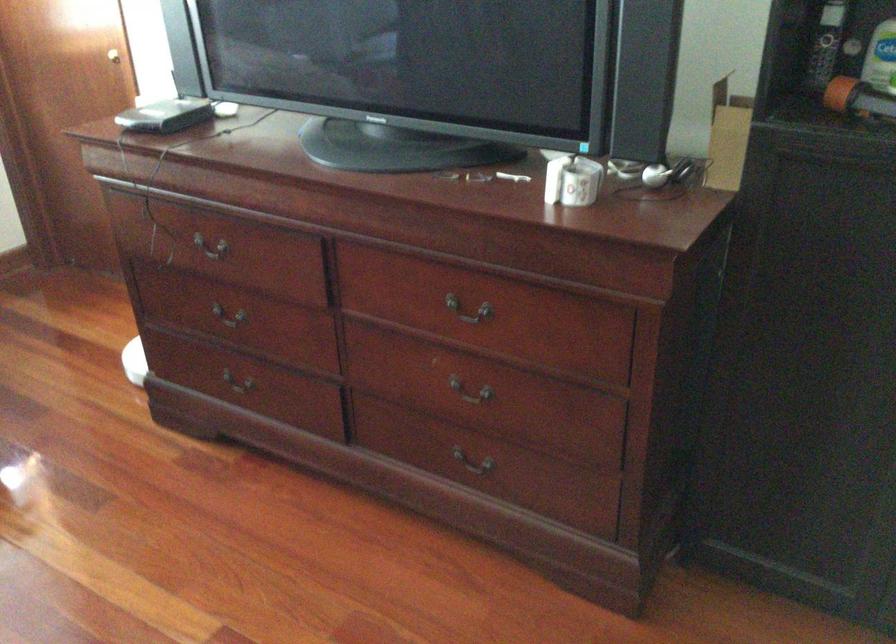
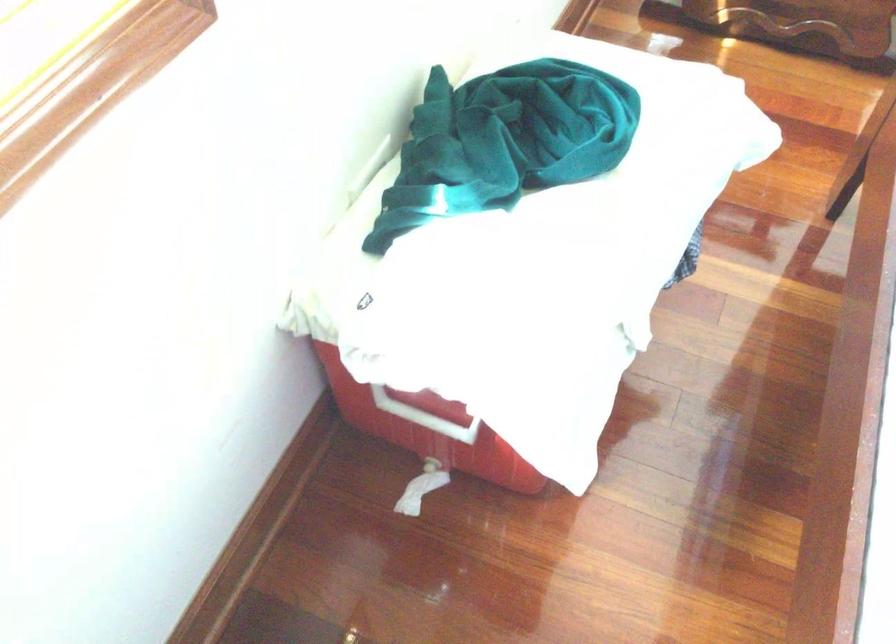
Question: Which direction would the cameraman need to move to produce the second image? Reply with the corresponding letter.

Choices:
 (A) Left
 (B) Right
 (C) Forward
 (D) Backward

Answer: (A)